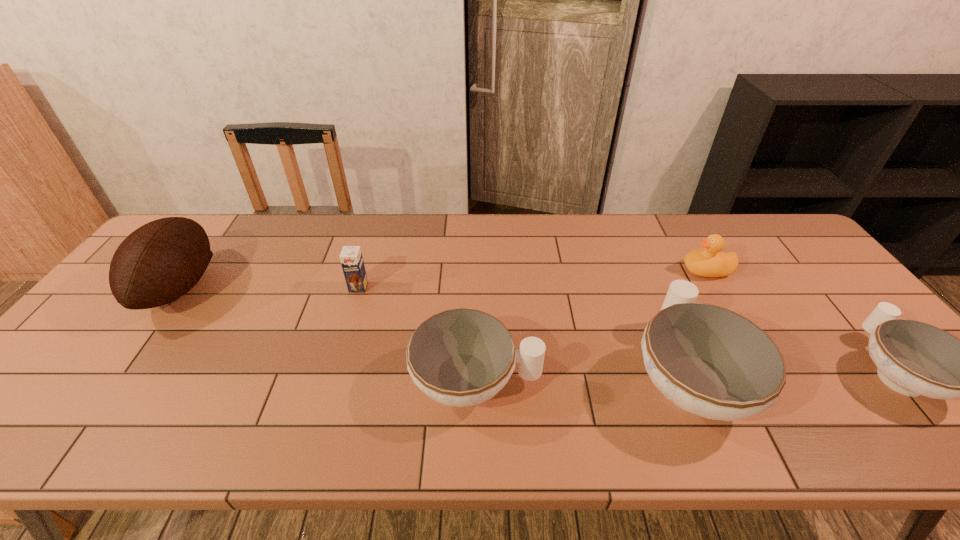
This screenshot has height=540, width=960. What are the coordinates of `vacant spot to place a chinaware on the left` in the screenshot? It's located at click(x=260, y=388).